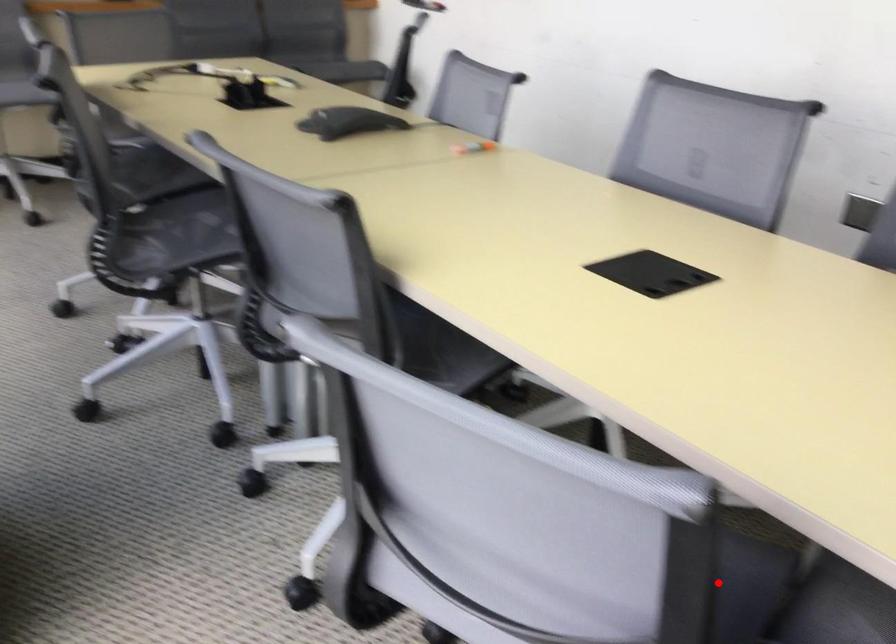
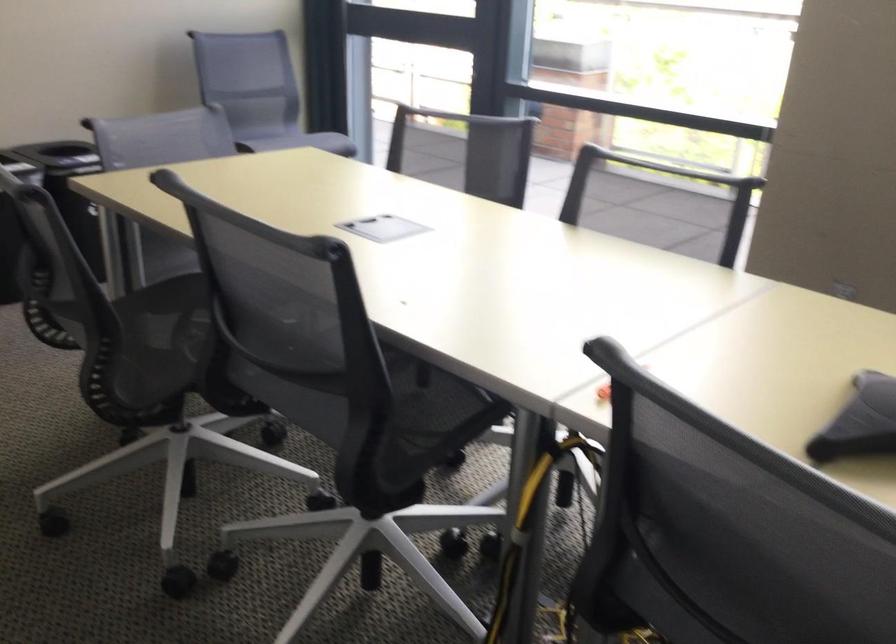
Question: I am providing you with two images of the same scene from different viewpoints. A red point is marked on the first image. Is the red point's position out of view in image 2?

Choices:
 (A) Yes
 (B) No

Answer: (A)